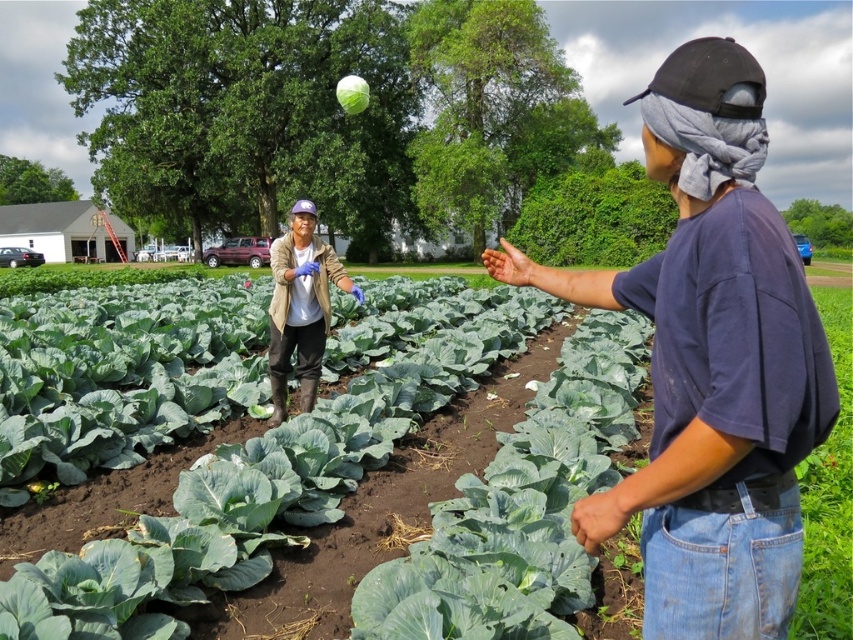
Question: Is green leafy vegetables at center below green leafy cabbage at upper center?

Choices:
 (A) no
 (B) yes

Answer: (B)

Question: Is green leafy cabbage at center below matte beige jacket at center?

Choices:
 (A) yes
 (B) no

Answer: (A)

Question: Among these points, which one is farthest from the camera?

Choices:
 (A) (128, 292)
 (B) (480, 586)
 (C) (281, 323)
 (D) (706, 67)

Answer: (A)

Question: Which point is closer to the camera taking this photo?

Choices:
 (A) (547, 580)
 (B) (732, 316)
 (C) (350, 108)

Answer: (B)

Question: Is green leafy vegetables at center to the right of green leafy cabbage at upper center from the viewer's perspective?

Choices:
 (A) yes
 (B) no

Answer: (A)

Question: Which point is farther from the camera taking this photo?

Choices:
 (A) (352, 74)
 (B) (393, 314)
 (C) (758, 412)
 (D) (386, 596)

Answer: (A)